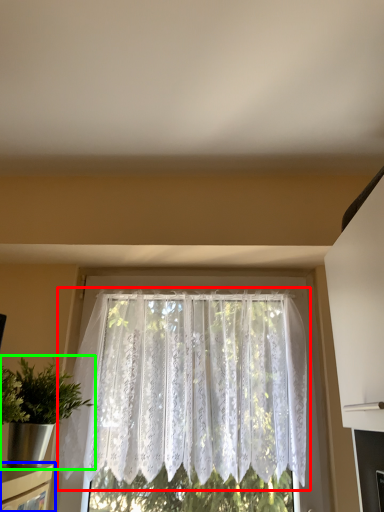
Question: Estimate the real-world distances between objects in this image. Which object is closer to window (highlighted by a red box), shelf (highlighted by a blue box) or houseplant (highlighted by a green box)?

Choices:
 (A) shelf
 (B) houseplant

Answer: (B)